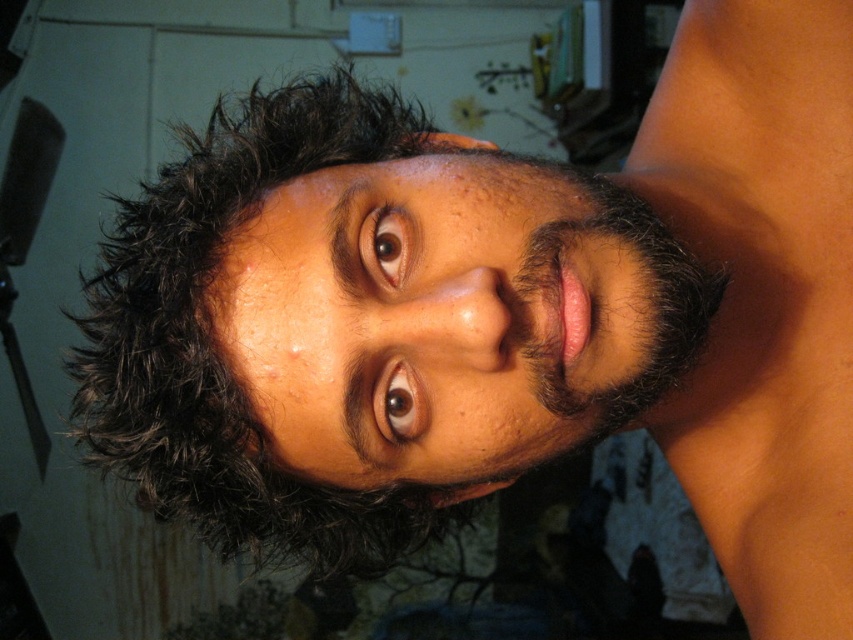
Question: Observing the image, what is the correct spatial positioning of smooth skin at upper right in reference to dark brown curly hair at upper center?

Choices:
 (A) above
 (B) below

Answer: (B)

Question: Which object is the farthest from the smooth skin at upper right?

Choices:
 (A) brown matte eye at upper center
 (B) dry skin face at center

Answer: (A)

Question: Is the position of dark brown curly hair at upper center less distant than that of brown matte eye at upper center?

Choices:
 (A) yes
 (B) no

Answer: (B)

Question: Can you confirm if dry skin face at center is bigger than dark brown curly hair at upper center?

Choices:
 (A) no
 (B) yes

Answer: (A)

Question: Estimate the real-world distances between objects in this image. Which object is closer to the brown matte eye at center?

Choices:
 (A) brown matte eye at upper center
 (B) dry skin face at center

Answer: (A)

Question: Among these points, which one is farthest from the camera?

Choices:
 (A) (636, 312)
 (B) (370, 224)
 (C) (830, 545)

Answer: (C)